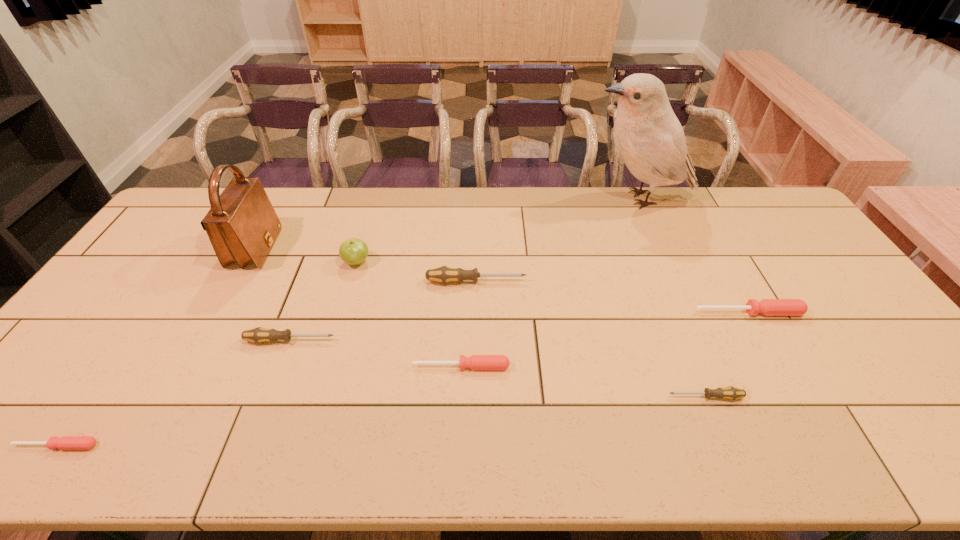
This screenshot has width=960, height=540. Find the location of `vacant space at the near right corner of the desktop`. vacant space at the near right corner of the desktop is located at coordinates (907, 431).

This screenshot has height=540, width=960. Find the location of `vacant space that is in between the white parakeet and the smallest gray screwdriver`. vacant space that is in between the white parakeet and the smallest gray screwdriver is located at coordinates (x=672, y=298).

In order to click on free space between the fourth farthest screwdriver and the green apple in this screenshot , I will do `click(409, 314)`.

Find the location of a particular element. The image size is (960, 540). unoccupied area between the third nearest object and the apple is located at coordinates (409, 314).

Identify the location of unoccupied position between the rightmost gray screwdriver and the farthest gray screwdriver. (590, 339).

In order to click on vacant space in between the fourth farthest object and the second nearest screwdriver in this screenshot , I will do `click(590, 339)`.

What are the coordinates of `free space between the shortest screwdriver and the nearest gray screwdriver` in the screenshot? It's located at (381, 421).

The image size is (960, 540). I want to click on vacant area that lies between the eighth object from right to left and the fifth screwdriver from right to left, so click(273, 294).

Identify the location of free space between the second nearest object and the farthest red screwdriver. The height and width of the screenshot is (540, 960). (727, 355).

You are a GUI agent. You are given a task and a screenshot of the screen. Output one action in this format:
    pyautogui.click(x=<x>, y=<y>)
    Task: Click on the empty space that is in between the second red screwdriver from left to right and the apple
    Image resolution: width=960 pixels, height=540 pixels.
    Given the screenshot: What is the action you would take?
    pyautogui.click(x=409, y=314)